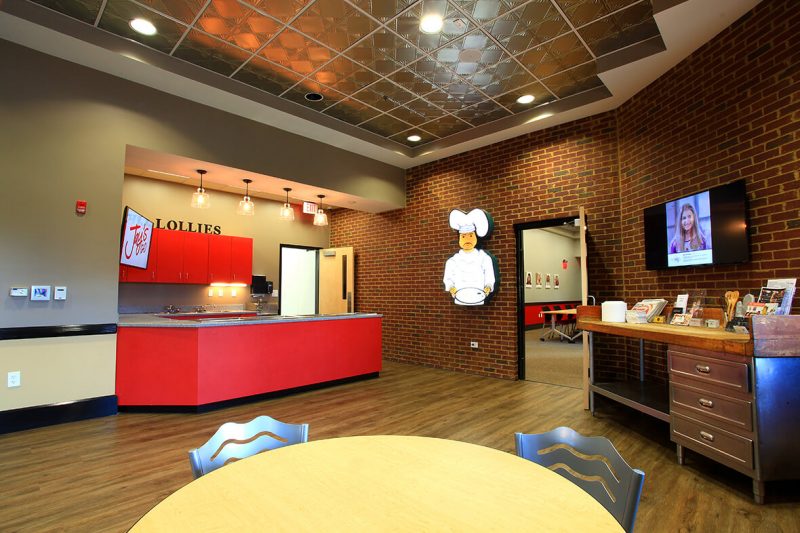
Locate an element on the screen. The image size is (800, 533). brick wall is located at coordinates (710, 122).